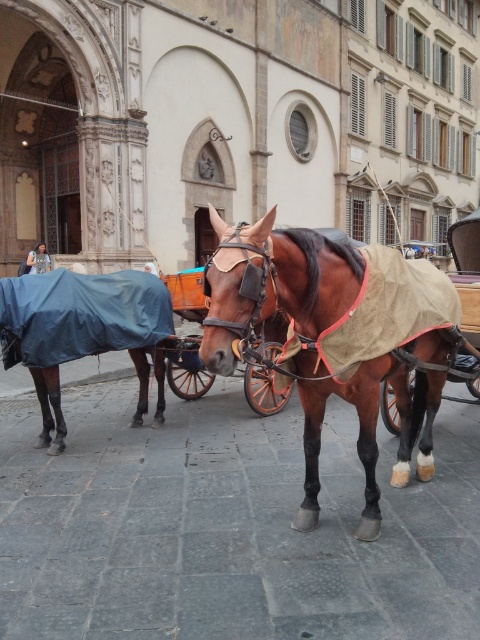
Question: Does brown glossy horse at center have a smaller size compared to blue fabric covered horse at lower left?

Choices:
 (A) no
 (B) yes

Answer: (A)

Question: Among these points, which one is farthest from the camera?

Choices:
 (A) (422, 336)
 (B) (147, 310)

Answer: (B)

Question: Which point is farther to the camera?

Choices:
 (A) (8, 292)
 (B) (373, 484)

Answer: (A)

Question: Can you confirm if brown glossy horse at center is positioned above blue fabric covered horse at lower left?

Choices:
 (A) no
 (B) yes

Answer: (A)

Question: Where is brown glossy horse at center located in relation to blue fabric covered horse at lower left in the image?

Choices:
 (A) above
 (B) below

Answer: (B)